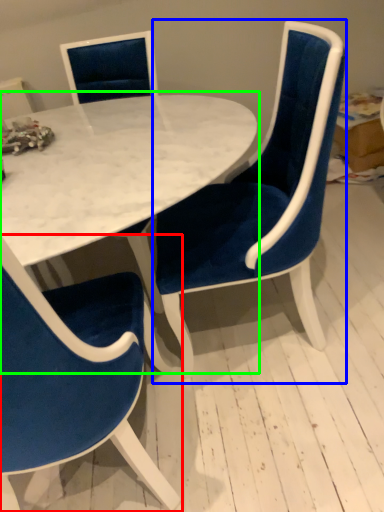
Question: Based on their relative distances, which object is nearer to chair (highlighted by a red box)? Choose from chair (highlighted by a blue box) and table (highlighted by a green box).

Choices:
 (A) chair
 (B) table

Answer: (B)